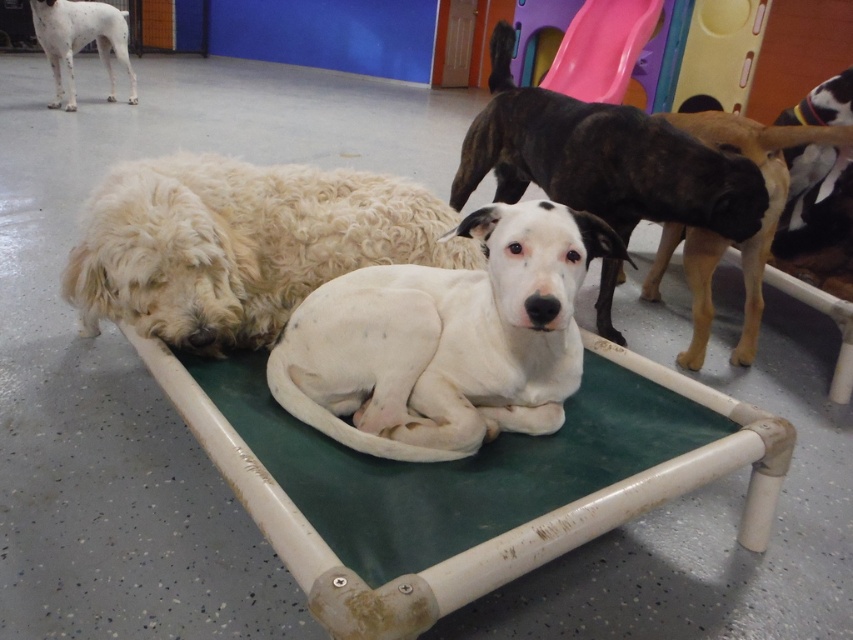
Is white smooth dog at center to the left of white fluffy dog at center from the viewer's perspective?

No, white smooth dog at center is not to the left of white fluffy dog at center.

Does white smooth dog at center have a smaller size compared to white fluffy dog at center?

Indeed, white smooth dog at center has a smaller size compared to white fluffy dog at center.

What do you see at coordinates (445, 339) in the screenshot? I see `white smooth dog at center` at bounding box center [445, 339].

This screenshot has height=640, width=853. Identify the location of white smooth dog at center. (445, 339).

Is point (477, 134) farther from viewer compared to point (54, 26)?

No, (477, 134) is closer to viewer.

Who is taller, brindle fur dog at center or white speckled fur at upper left?

Standing taller between the two is brindle fur dog at center.

Find the location of a particular element. This screenshot has width=853, height=640. brindle fur dog at center is located at coordinates (601, 157).

Locate an element on the screen. This screenshot has width=853, height=640. brindle fur dog at center is located at coordinates (601, 157).

How far apart are green fabric dog bed at center and white speckled fur at upper left?

A distance of 17.29 feet exists between green fabric dog bed at center and white speckled fur at upper left.

Who is positioned more to the left, green fabric dog bed at center or white speckled fur at upper left?

Positioned to the left is white speckled fur at upper left.

What do you see at coordinates (465, 484) in the screenshot? This screenshot has width=853, height=640. I see `green fabric dog bed at center` at bounding box center [465, 484].

The image size is (853, 640). Find the location of `green fabric dog bed at center`. green fabric dog bed at center is located at coordinates (465, 484).